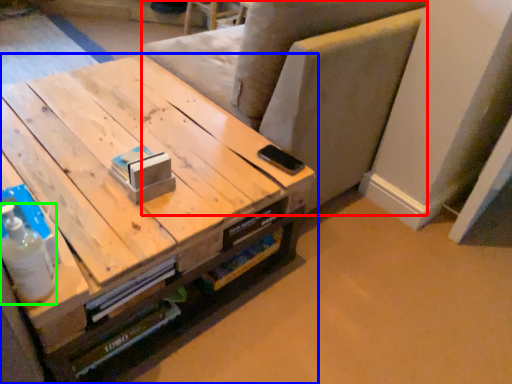
Question: Which object is positioned farthest from armchair (highlighted by a red box)? Select from table (highlighted by a blue box) and bottle (highlighted by a green box).

Choices:
 (A) table
 (B) bottle

Answer: (B)